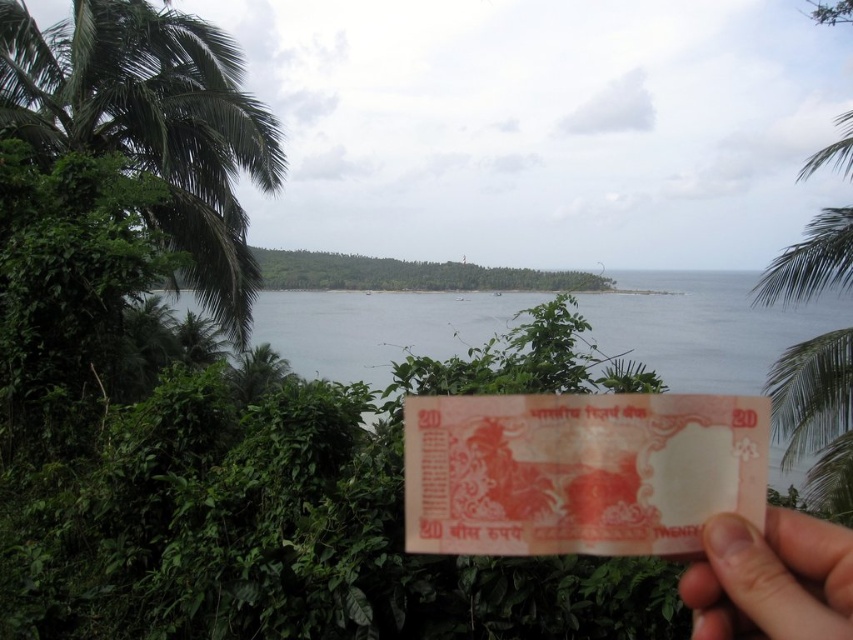
You are a photographer planning to capture a wide shot of the tropical coastal landscape. You want to include both the transparent water at center and the pink matte paper at lower right in your frame. Which object will occupy more space in your final photograph?

The transparent water at center will occupy more space in the final photograph because it is bigger than the pink matte paper at lower right according to the description.

Based on the scene description, what object is located at the coordinates point (151, 124)?

The green leafy palm tree at left is located at point (151, 124).

You are a collector of rare paper items and you see both the pink paper currency at center and the pink matte paper at lower right in the image. Which one is positioned more to the right side?

The pink matte paper at lower right is positioned more to the right side than the pink paper currency at center.